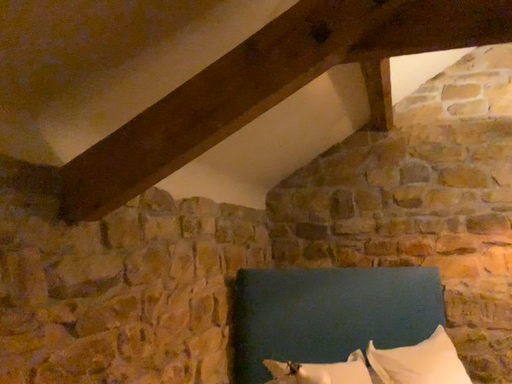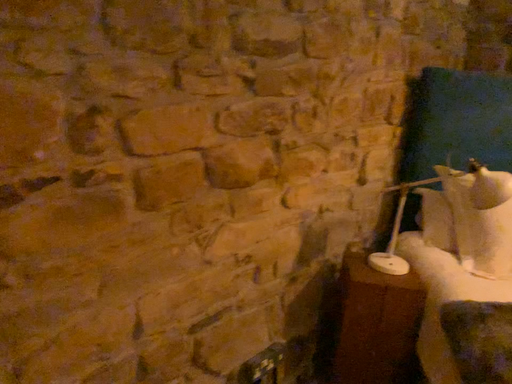
Question: How did the camera likely rotate when shooting the video?

Choices:
 (A) rotated upward
 (B) rotated downward

Answer: (B)